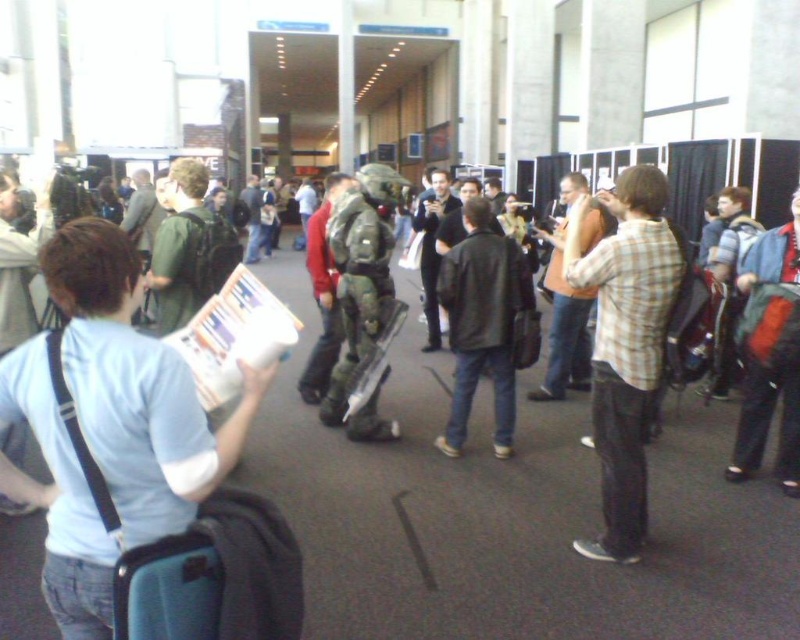
Question: Estimate the real-world distances between objects in this image. Which object is closer to the green matte armor at center?

Choices:
 (A) leather jacket at center
 (B) white matte t-shirt at center

Answer: (A)

Question: Which of the following is the closest to the observer?

Choices:
 (A) green matte armor at center
 (B) blue backpack at right
 (C) plaid shirt at center

Answer: (C)

Question: Which point is farther to the camera?

Choices:
 (A) (480, 232)
 (B) (370, 332)
 (C) (658, 177)

Answer: (B)

Question: Does plaid shirt at center have a larger size compared to leather jacket at center?

Choices:
 (A) no
 (B) yes

Answer: (A)

Question: Is leather jacket at center further to the viewer compared to green matte armor at center?

Choices:
 (A) no
 (B) yes

Answer: (A)

Question: Is white matte t-shirt at center bigger than plaid shirt at center?

Choices:
 (A) no
 (B) yes

Answer: (A)